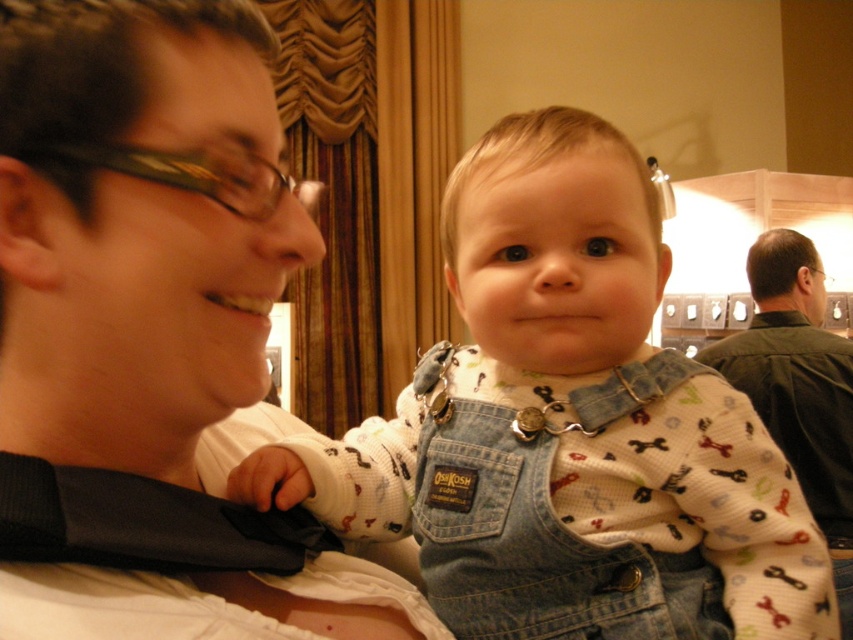
You are standing in the scene and want to place a small gift exactly at the point marked by the coordinates point (x=132, y=369). If your hand is currently 12 inches away from that point, how much further do you need to move your hand to reach the exact location?

The point (x=132, y=369) is 14.23 inches away from the viewer. Since your hand is already 12 inches away, you need to move an additional 2.23 inches to reach the point.

You are a photographer setting up for a family portrait. You need to ensure that the matte black tie at left and the denim overalls at center are visible in the shot. Based on their positions, which object is higher in the frame?

The matte black tie at left is located above denim overalls at center, so it is higher in the frame.